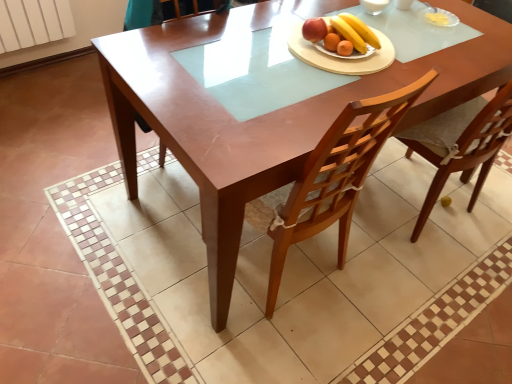
Locate an element on the screen. vacant space situated on the left part of wooden table at center is located at coordinates (70, 182).